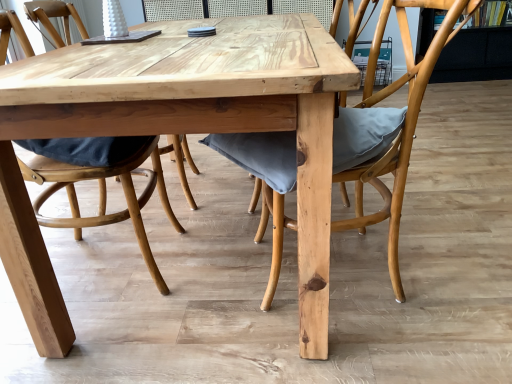
At what (x,y) coordinates should I click in order to perform the action: click on empty space that is in between matte wood chair at center, which is counted as the first chair, starting from the left, and matte gray cushion at center, the second chair viewed from the left. Please return your answer as a coordinate pair (x, y). This screenshot has height=384, width=512. Looking at the image, I should click on (205, 269).